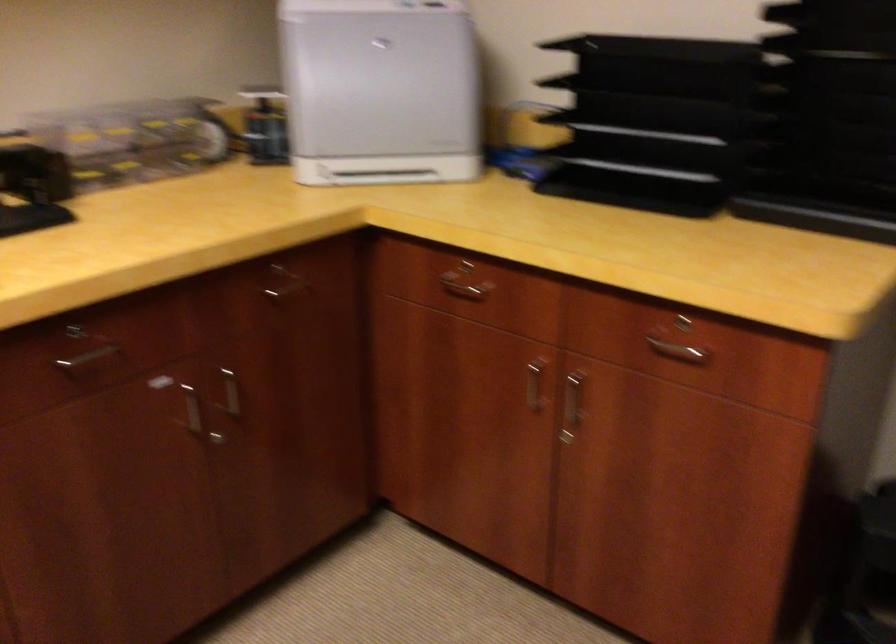
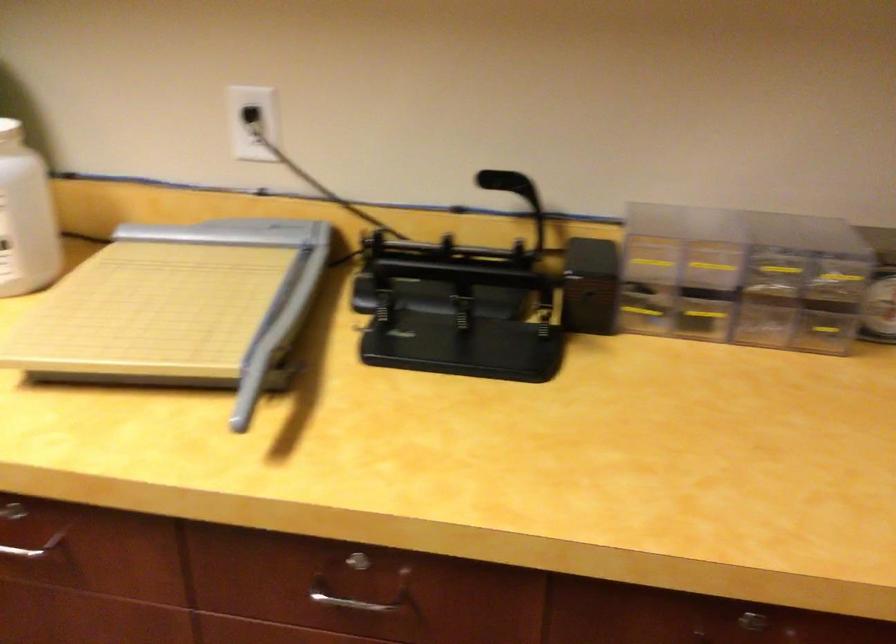
In the second image, find the point that corresponds to pixel 286 267 in the first image.

(748, 623)